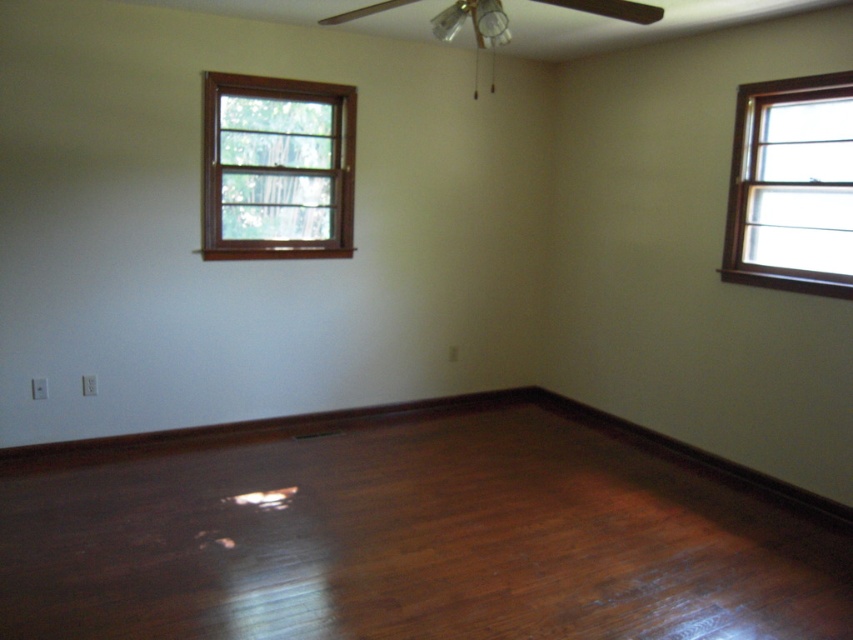
Which of these two, shiny brown hardwood floor at center or wooden window at upper right, stands taller?

wooden window at upper right is taller.

Is the position of shiny brown hardwood floor at center less distant than that of wooden window at upper right?

Yes.

This screenshot has width=853, height=640. Describe the element at coordinates (415, 532) in the screenshot. I see `shiny brown hardwood floor at center` at that location.

The image size is (853, 640). Identify the location of shiny brown hardwood floor at center. (415, 532).

Can you confirm if shiny brown hardwood floor at center is wider than brown wooden window at upper left?

Indeed, shiny brown hardwood floor at center has a greater width compared to brown wooden window at upper left.

Between point (404, 448) and point (234, 93), which one is positioned in front?

Positioned in front is point (234, 93).

Which is in front, point (634, 541) or point (309, 104)?

Point (634, 541)

Locate an element on the screen. The width and height of the screenshot is (853, 640). shiny brown hardwood floor at center is located at coordinates (415, 532).

Describe the element at coordinates (276, 168) in the screenshot. I see `brown wooden window at upper left` at that location.

Which of these two, brown wooden window at upper left or wooden window at upper right, stands shorter?

brown wooden window at upper left is shorter.

The width and height of the screenshot is (853, 640). I want to click on brown wooden window at upper left, so 276,168.